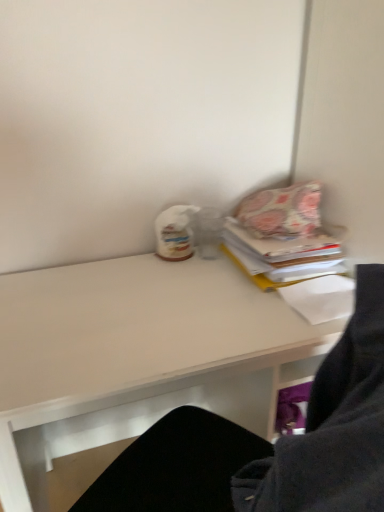
The height and width of the screenshot is (512, 384). I want to click on vacant space positioned to the left of patterned fabric book at upper right, so click(x=183, y=276).